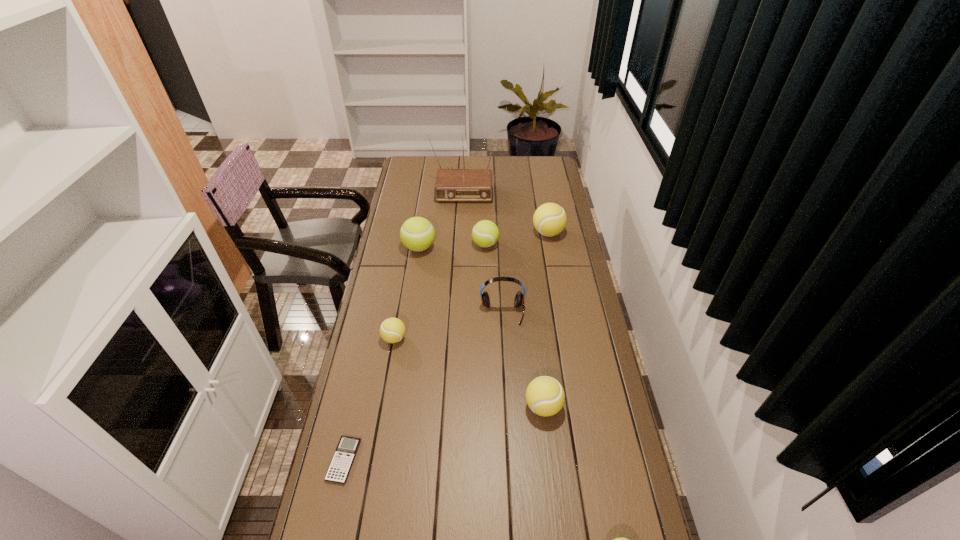
The height and width of the screenshot is (540, 960). Identify the location of vacant area situated on the right of the smallest yellow tennis ball. (482, 339).

Image resolution: width=960 pixels, height=540 pixels. I want to click on free space located 0.170m on the back of the shortest object, so click(x=360, y=388).

Where is `object present at the far edge`? This screenshot has height=540, width=960. object present at the far edge is located at coordinates (451, 185).

Where is `calculator present at the left edge`? This screenshot has height=540, width=960. calculator present at the left edge is located at coordinates (341, 463).

Where is `object located at the right edge`? This screenshot has height=540, width=960. object located at the right edge is located at coordinates (549, 219).

Locate an element on the screen. This screenshot has width=960, height=540. vacant space at the far edge of the desktop is located at coordinates (468, 157).

The width and height of the screenshot is (960, 540). In the image, there is a desktop. Identify the location of vacant space at the left edge. (351, 411).

You are a GUI agent. You are given a task and a screenshot of the screen. Output one action in this format:
    pyautogui.click(x=<x>, y=<y>)
    Task: Click on the vacant space at the right edge of the desktop
    This screenshot has height=540, width=960.
    Given the screenshot: What is the action you would take?
    pyautogui.click(x=563, y=296)

In the image, there is a desktop. What are the coordinates of `vacant space at the far left corner` in the screenshot? It's located at (406, 160).

In the image, there is a desktop. Where is `vacant space at the far right corner`? The height and width of the screenshot is (540, 960). vacant space at the far right corner is located at coordinates (549, 157).